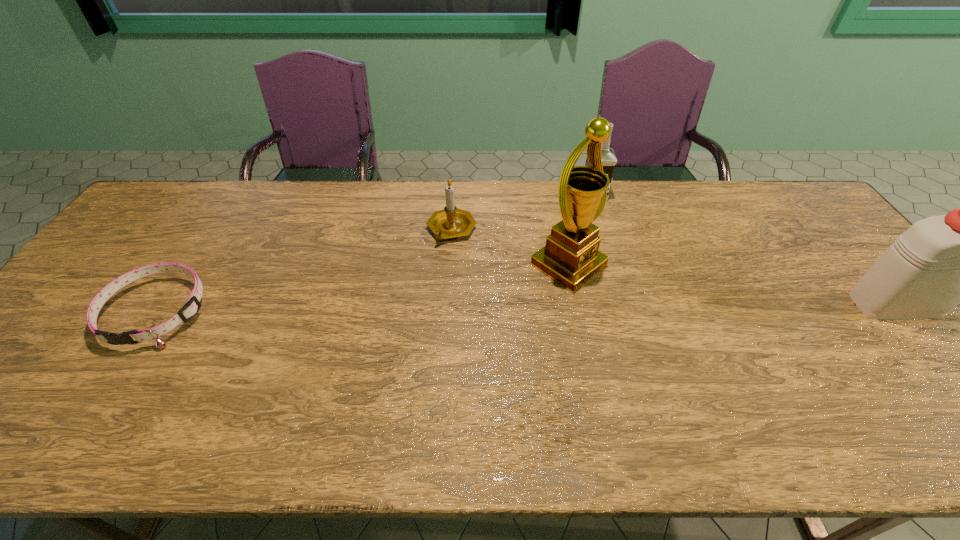
This screenshot has height=540, width=960. Identify the location of empty space between the tallest object and the second shortest object. (510, 247).

Where is `free point between the candle holder and the dog collar`? Image resolution: width=960 pixels, height=540 pixels. free point between the candle holder and the dog collar is located at coordinates (304, 271).

Where is `empty space that is in between the leftmost object and the tallest object`? Image resolution: width=960 pixels, height=540 pixels. empty space that is in between the leftmost object and the tallest object is located at coordinates (363, 288).

Locate an element on the screen. vacant point located between the fourth tallest object and the third tallest object is located at coordinates (522, 212).

Locate an element on the screen. This screenshot has width=960, height=540. vacant space that is in between the second tallest object and the vodka is located at coordinates (744, 249).

You are a GUI agent. You are given a task and a screenshot of the screen. Output one action in this format:
    pyautogui.click(x=<x>, y=<y>)
    Task: Click on the empty space that is in between the award and the rightmost object
    
    Given the screenshot: What is the action you would take?
    pyautogui.click(x=732, y=285)

I want to click on vacant space in between the farthest object and the dog collar, so [x=375, y=253].

This screenshot has height=540, width=960. Find the location of `free space between the vodka and the fourth object from right to left`. free space between the vodka and the fourth object from right to left is located at coordinates (522, 212).

The image size is (960, 540). I want to click on empty space that is in between the vodka and the shortest object, so click(x=375, y=253).

Choose which object is the fourth nearest neighbor to the second tallest object. Please provide its 2D coordinates. Your answer should be formatted as a tuple, i.e. [(x, y)], where the tuple contains the x and y coordinates of a point satisfying the conditions above.

[(189, 310)]